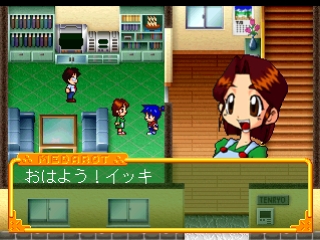
The width and height of the screenshot is (320, 240). Find the location of `window`. window is located at coordinates (209, 13).